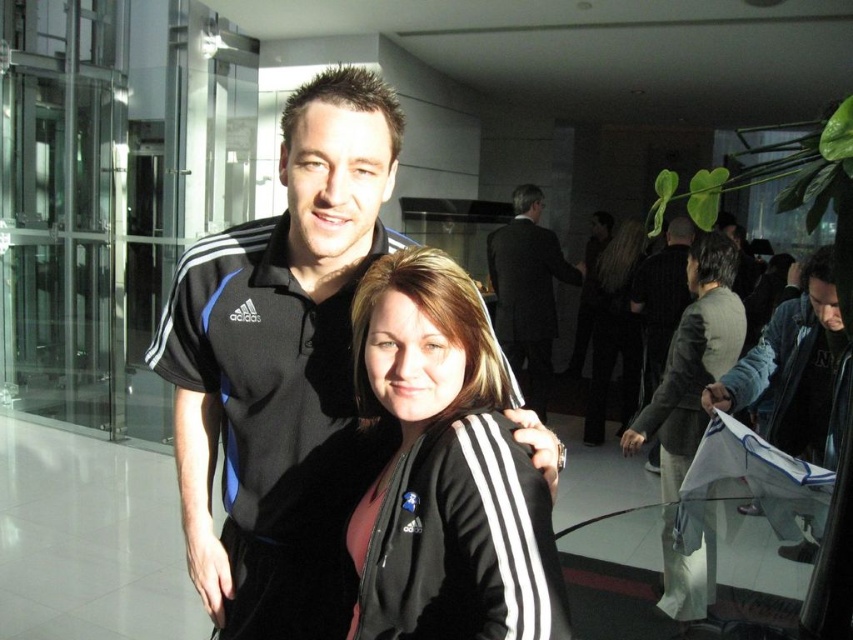
You are a photographer setting up for a group photo. You notice two people in the front row wearing the black adidas polo shirt at center and the dark suit at center. To ensure both are framed properly, which clothing item should you adjust to match their heights?

The black adidas polo shirt at center is shorter than the dark suit at center, so you should adjust the dark suit at center to be shorter or the black adidas polo shirt at center to be taller to match their heights.

Consider the image. You are organizing a clothing display and need to place the black adidas polo shirt at center and the black fabric jacket at center on a rack. Given that the rack has a height limit of 30 inches, can you determine if both items will fit vertically without overlapping?

The black adidas polo shirt at center is smaller than the black fabric jacket at center. Since the rack has a height limit of 30 inches, and the jacket is larger, it is possible that both items will fit vertically if the combined height of both items does not exceed 30 inches. However, without specific measurements, we cannot confirm for certain.

You are standing in the office space and want to take a photo of the black adidas polo shirt at center. Where should you aim your camera to capture it?

You should aim your camera at point (283, 371) to capture the black adidas polo shirt at center.